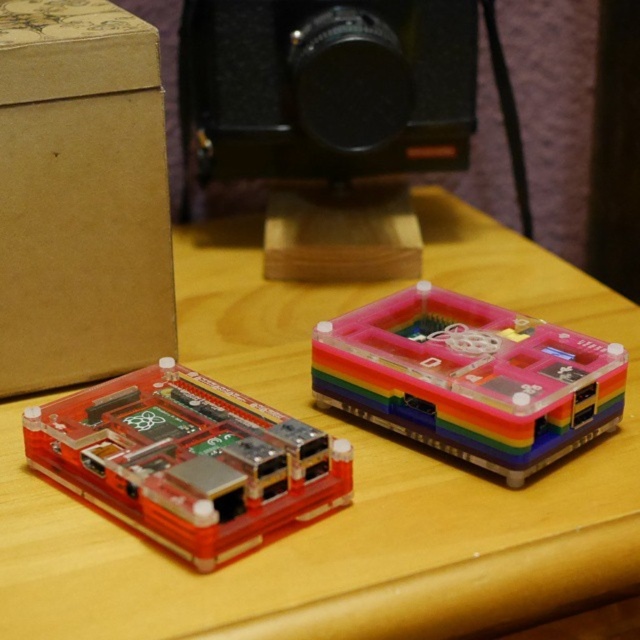
Question: Which point appears closest to the camera in this image?

Choices:
 (A) (65, 35)
 (B) (154, 483)

Answer: (B)

Question: Is black plastic camera at upper center smaller than rainbow plastic raspberry pi at center?

Choices:
 (A) no
 (B) yes

Answer: (B)

Question: Which point is farther to the camera?

Choices:
 (A) (88, 296)
 (B) (83, 454)
 (C) (448, 353)
 (D) (340, 154)

Answer: (D)

Question: Among these points, which one is farthest from the camera?

Choices:
 (A) (56, 452)
 (B) (577, 371)
 (C) (112, 336)
 (D) (282, 84)

Answer: (D)

Question: Is translucent plastic electronics at center positioned in front of brown cardboard box at upper left?

Choices:
 (A) no
 (B) yes

Answer: (B)

Question: Does brown cardboard box at upper left come behind black plastic camera at upper center?

Choices:
 (A) yes
 (B) no

Answer: (B)